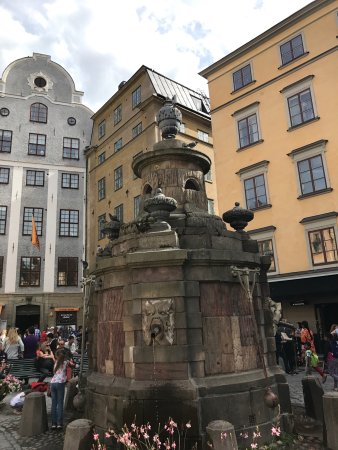
Locate an element on the screen. yellow painted wall is located at coordinates (289, 241).